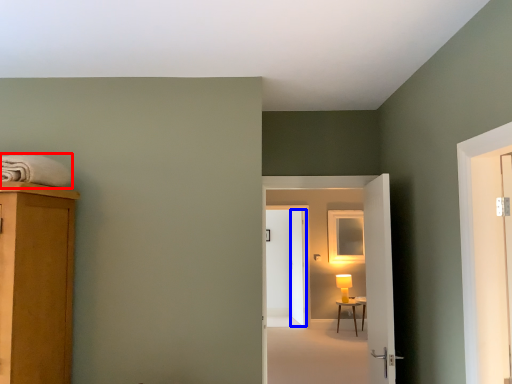
Question: Among these objects, which one is nearest to the camera, bath towel (highlighted by a red box) or screen door (highlighted by a blue box)?

Choices:
 (A) bath towel
 (B) screen door

Answer: (A)